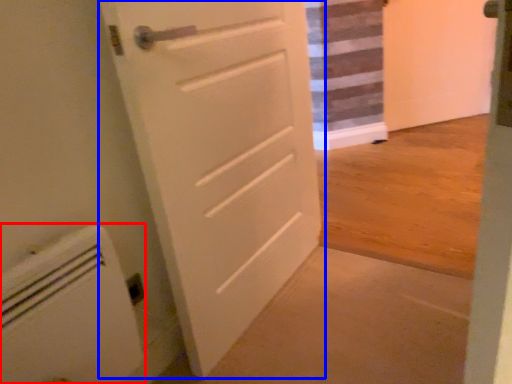
Question: Which object is further to the camera taking this photo, appliance (highlighted by a red box) or door (highlighted by a blue box)?

Choices:
 (A) appliance
 (B) door

Answer: (B)